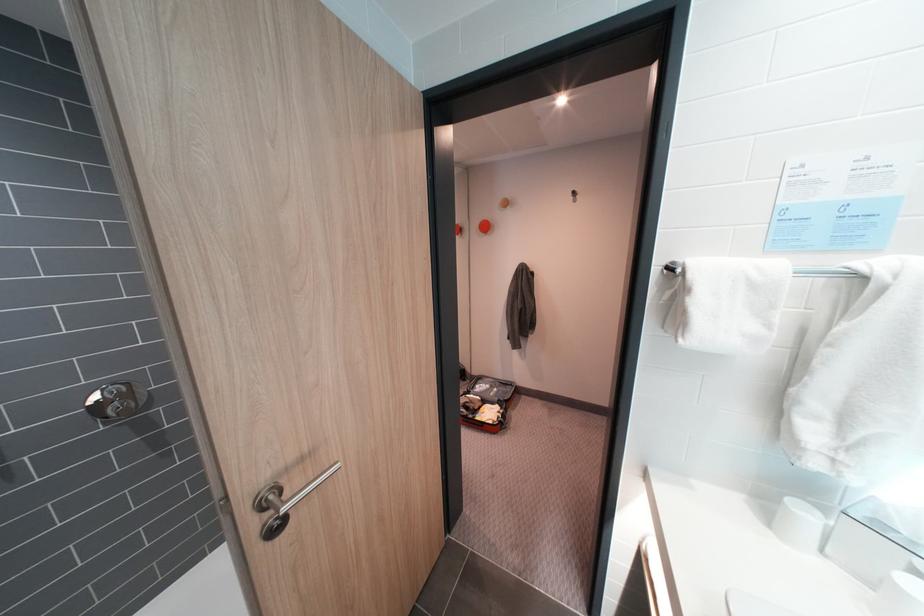
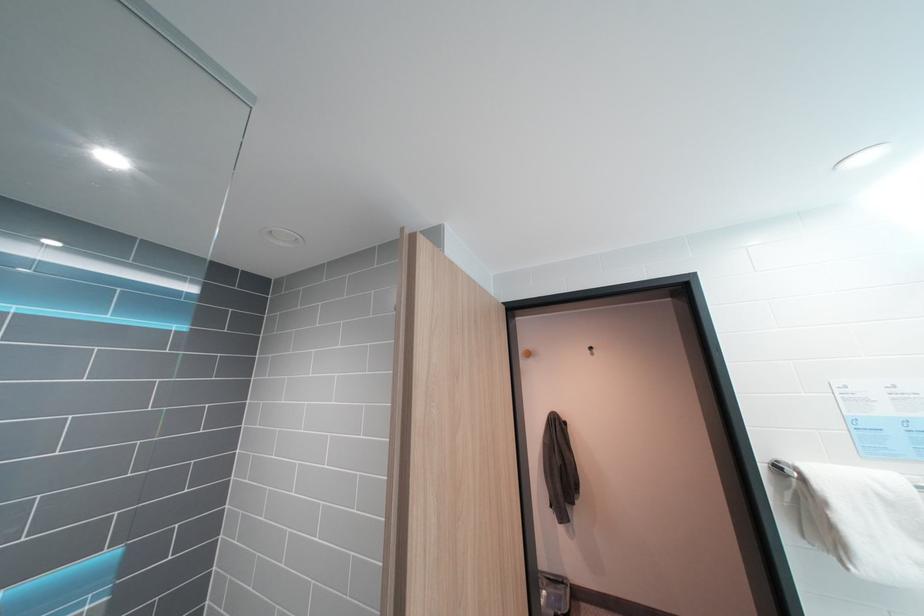
The images are taken continuously from a first-person perspective. In which direction are you moving?

The cameraman walked toward left, backward.